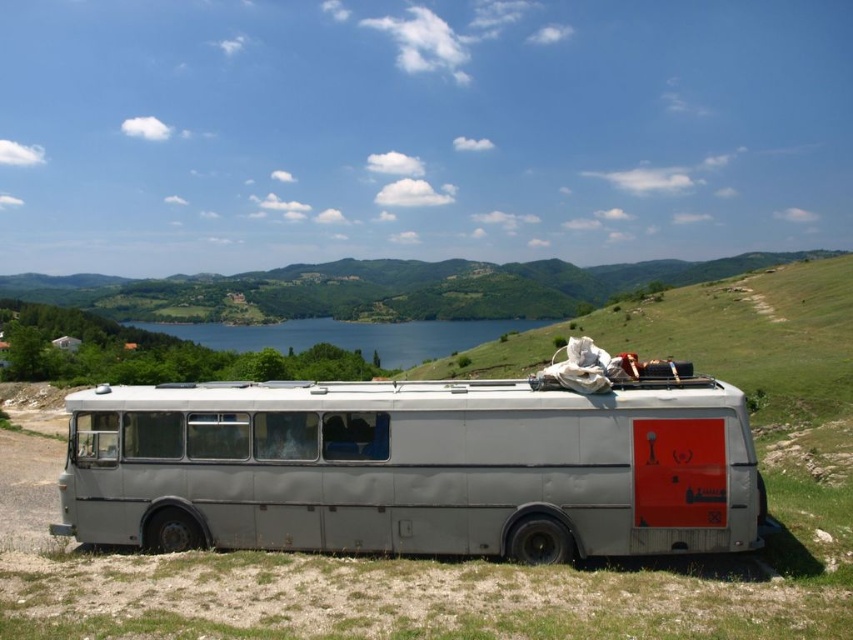
Question: Is gray matte van at center below blue water at center?

Choices:
 (A) no
 (B) yes

Answer: (A)

Question: Is gray matte van at center smaller than blue water at center?

Choices:
 (A) yes
 (B) no

Answer: (A)

Question: Which object appears closest to the camera in this image?

Choices:
 (A) blue water at center
 (B) gray matte van at center

Answer: (B)

Question: Is gray matte van at center positioned at the back of blue water at center?

Choices:
 (A) no
 (B) yes

Answer: (A)

Question: Which point appears closest to the camera in this image?

Choices:
 (A) (222, 339)
 (B) (566, 545)

Answer: (B)